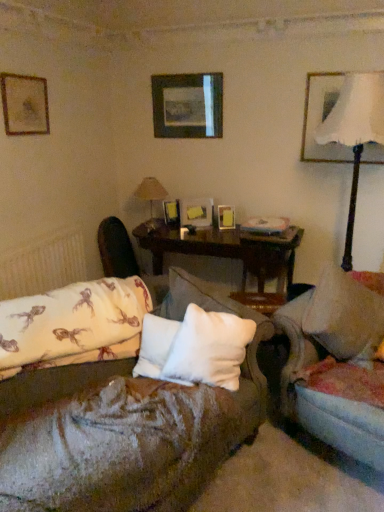
Question: Is velvet beige couch at center at the left side of wooden picture frame at center, which is counted as the fourth picture frame, starting from the right?

Choices:
 (A) yes
 (B) no

Answer: (B)

Question: Considering the relative sizes of velvet beige couch at center and wooden picture frame at center, positioned as the 3th picture frame in left-to-right order, in the image provided, is velvet beige couch at center thinner than wooden picture frame at center, positioned as the 3th picture frame in left-to-right order,?

Choices:
 (A) no
 (B) yes

Answer: (A)

Question: Is velvet beige couch at center behind wooden picture frame at center, positioned as the 3th picture frame in left-to-right order?

Choices:
 (A) yes
 (B) no

Answer: (B)

Question: Would you consider velvet beige couch at center to be distant from wooden picture frame at center, which is counted as the fourth picture frame, starting from the right?

Choices:
 (A) yes
 (B) no

Answer: (A)

Question: Does velvet beige couch at center have a smaller size compared to wooden picture frame at center, which is counted as the fourth picture frame, starting from the right?

Choices:
 (A) no
 (B) yes

Answer: (A)

Question: From their relative heights in the image, would you say white soft pillow at center, placed as the first pillow when sorted from left to right, is taller or shorter than wooden picture frame at center, marked as the fifth picture frame in a left-to-right arrangement?

Choices:
 (A) tall
 (B) short

Answer: (A)

Question: From the image's perspective, is white soft pillow at center, placed as the first pillow when sorted from left to right, located above or below wooden picture frame at center, marked as the fifth picture frame in a left-to-right arrangement?

Choices:
 (A) above
 (B) below

Answer: (B)

Question: Is point (163, 329) positioned closer to the camera than point (226, 207)?

Choices:
 (A) farther
 (B) closer

Answer: (B)

Question: Considering the relative positions of white soft pillow at center, placed as the first pillow when sorted from left to right, and wooden picture frame at center, the 2th picture frame viewed from the right, in the image provided, is white soft pillow at center, placed as the first pillow when sorted from left to right, to the left or to the right of wooden picture frame at center, the 2th picture frame viewed from the right,?

Choices:
 (A) right
 (B) left

Answer: (B)

Question: Is velvet dark brown swivel chair at center taller or shorter than velvet beige couch at center?

Choices:
 (A) tall
 (B) short

Answer: (B)

Question: Does point (165, 276) appear closer or farther from the camera than point (349, 310)?

Choices:
 (A) farther
 (B) closer

Answer: (A)

Question: Based on their sizes in the image, would you say velvet dark brown swivel chair at center is bigger or smaller than velvet beige couch at center?

Choices:
 (A) big
 (B) small

Answer: (B)

Question: Do you think velvet dark brown swivel chair at center is within velvet beige couch at center, or outside of it?

Choices:
 (A) outside
 (B) inside

Answer: (A)

Question: Considering the positions of wooden picture frame at center, which is counted as the fourth picture frame, starting from the right, and white soft pillow at center, the first pillow positioned from the right, in the image, is wooden picture frame at center, which is counted as the fourth picture frame, starting from the right, taller or shorter than white soft pillow at center, the first pillow positioned from the right,?

Choices:
 (A) short
 (B) tall

Answer: (B)

Question: Is wooden picture frame at center, which is counted as the fourth picture frame, starting from the right, wider or thinner than white soft pillow at center, the first pillow positioned from the right?

Choices:
 (A) thin
 (B) wide

Answer: (A)